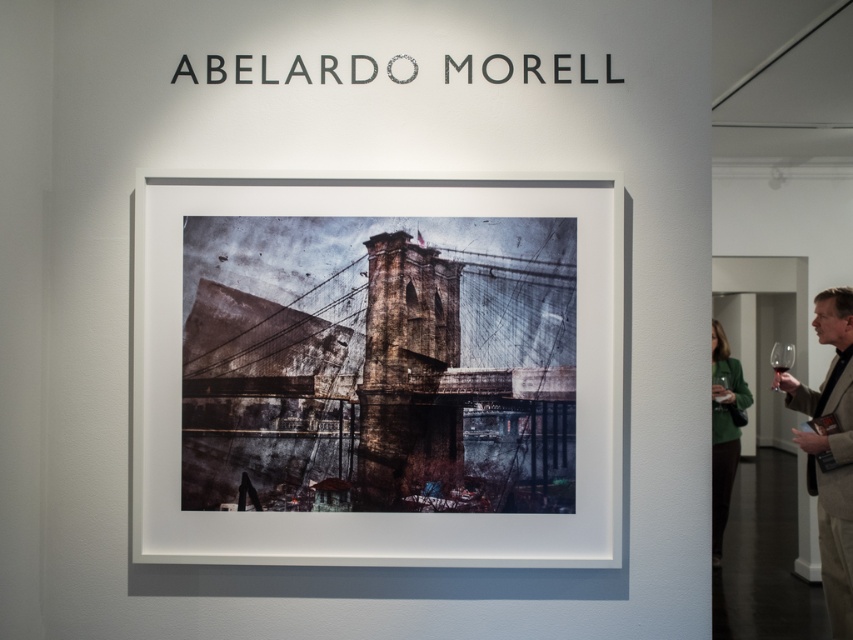
You are an art enthusiast visiting the gallery and notice the brown leather jacket at lower right and the transparent glass at center. Which object is taller?

The brown leather jacket at lower right is much taller than the transparent glass at center.

You are an art enthusiast standing in front of the framed photograph of the Brooklyn Bridge in the gallery. You notice a brown leather jacket at lower right and a transparent glass at upper center. Which object is taller?

The brown leather jacket at lower right is much taller than the transparent glass at upper center.

You are an art enthusiast standing in front of the framed photograph of the Brooklyn Bridge in the gallery. You notice a brown leather jacket at lower right and a transparent glass at upper center. Which object has a greater width?

The brown leather jacket at lower right has a greater width than the transparent glass at upper center.